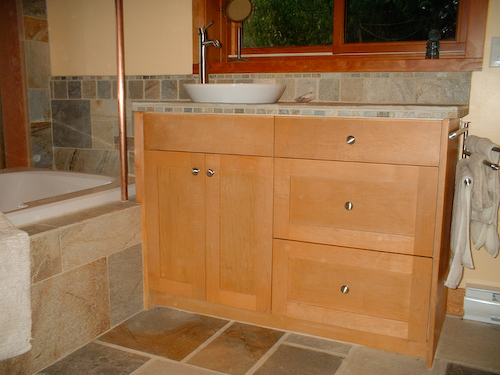
You are a GUI agent. You are given a task and a screenshot of the screen. Output one action in this format:
    pyautogui.click(x=<x>, y=<y>)
    Task: Click on the towels
    The image size is (500, 375).
    Given the screenshot: What is the action you would take?
    pyautogui.click(x=461, y=256)